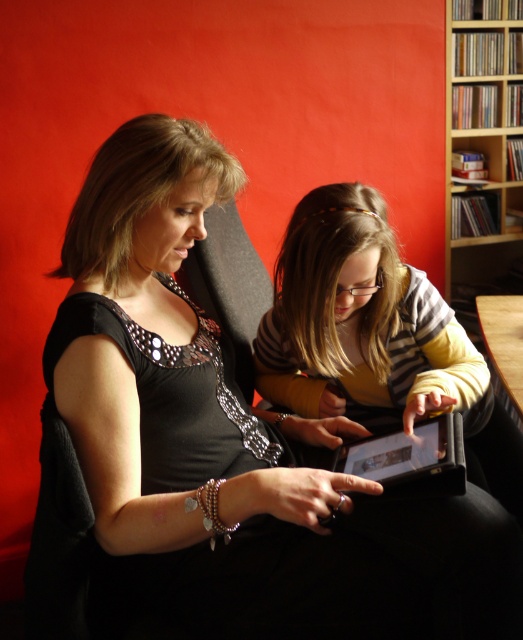
You are designing a new desk that needs to accommodate both the matte black tablet at center and the wooden bookshelf at upper right. What should you consider about their sizes?

The matte black tablet at center is wider than the wooden bookshelf at upper right, so the desk must have enough space to place both items side by side without overcrowding.

You are an interior designer analyzing the layout of this room. The matte black tablet at center and wooden bookshelf at upper right are both important elements in the design. Based on their positions, which object is closer to the left side of the room?

A: The matte black tablet at center is to the left of the wooden bookshelf at upper right, so it is closer to the left side of the room.